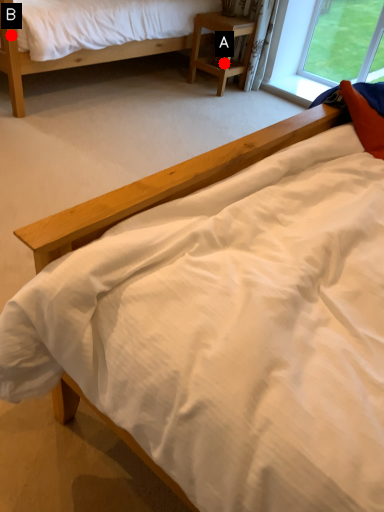
Question: Two points are circled on the image, labeled by A and B beside each circle. Which point is farther to the camera?

Choices:
 (A) A is further
 (B) B is further

Answer: (A)